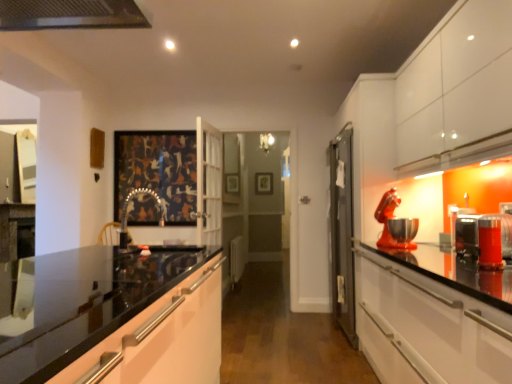
What do you see at coordinates (391, 218) in the screenshot?
I see `metallic red stand mixer at right, which is the fourth appliance in front-to-back order` at bounding box center [391, 218].

Identify the location of metallic silver toaster at right, the second appliance from the front. (506, 229).

You are a GUI agent. You are given a task and a screenshot of the screen. Output one action in this format:
    pyautogui.click(x=<x>, y=<y>)
    Task: Click on the metallic faucet at center
    This screenshot has height=384, width=512.
    Given the screenshot: What is the action you would take?
    pyautogui.click(x=128, y=214)

Describe the element at coordinates (162, 338) in the screenshot. I see `glossy black countertop at center` at that location.

Where is `wooden picture frame at center, the 1th picture frame in the back-to-front sequence`? The image size is (512, 384). wooden picture frame at center, the 1th picture frame in the back-to-front sequence is located at coordinates (264, 183).

The width and height of the screenshot is (512, 384). What do you see at coordinates (478, 234) in the screenshot? I see `metallic silver toaster at right, the 3th appliance in the front-to-back sequence` at bounding box center [478, 234].

In order to click on metallic red stand mixer at right, which is the fourth appliance in front-to-back order in this screenshot , I will do `click(391, 218)`.

From a real-world perspective, does metallic silver toaster at right, the 3th appliance in the front-to-back sequence, sit lower than metallic faucet at center?

Yes, from a real-world perspective, metallic silver toaster at right, the 3th appliance in the front-to-back sequence, is beneath metallic faucet at center.

Consider the image. Is metallic silver toaster at right, which is counted as the 2th appliance, starting from the back, situated inside metallic faucet at center or outside?

metallic silver toaster at right, which is counted as the 2th appliance, starting from the back, exists outside the volume of metallic faucet at center.

Between metallic silver toaster at right, the 3th appliance in the front-to-back sequence, and metallic faucet at center, which one has less height?

metallic silver toaster at right, the 3th appliance in the front-to-back sequence, is shorter.

Considering the positions of objects metallic faucet at center and metallic silver toaster at right, the 3th appliance in the front-to-back sequence, in the image provided, who is more to the left, metallic faucet at center or metallic silver toaster at right, the 3th appliance in the front-to-back sequence,?

Positioned to the left is metallic faucet at center.

Locate an element on the screen. This screenshot has width=512, height=384. faucet behind the metallic silver toaster at right, the 3th appliance in the front-to-back sequence is located at coordinates (128, 214).

From the image's perspective, is metallic faucet at center above or below metallic silver toaster at right, which is counted as the 2th appliance, starting from the back?

metallic faucet at center is above metallic silver toaster at right, which is counted as the 2th appliance, starting from the back.

From a real-world perspective, which object stands above the other?

metallic faucet at center, from a real-world perspective.

From a real-world perspective, is metallic red stand mixer at right, which is the fourth appliance in front-to-back order, positioned above or below metallic faucet at center?

From a real-world perspective, metallic red stand mixer at right, which is the fourth appliance in front-to-back order, is physically above metallic faucet at center.

Considering the sizes of objects metallic red stand mixer at right, the 1th appliance from the back, and metallic faucet at center in the image provided, who is bigger, metallic red stand mixer at right, the 1th appliance from the back, or metallic faucet at center?

metallic red stand mixer at right, the 1th appliance from the back, is bigger.

Which object is further away from the camera, metallic red stand mixer at right, which is the fourth appliance in front-to-back order, or metallic faucet at center?

metallic red stand mixer at right, which is the fourth appliance in front-to-back order, is more distant.

Considering the relative positions of glossy black countertop at center and metallic silver toaster at right, which is counted as the 2th appliance, starting from the back, in the image provided, is glossy black countertop at center behind metallic silver toaster at right, which is counted as the 2th appliance, starting from the back,?

No.

Looking at this image, is glossy black countertop at center not within metallic silver toaster at right, which is counted as the 2th appliance, starting from the back?

Yes, glossy black countertop at center is located beyond the bounds of metallic silver toaster at right, which is counted as the 2th appliance, starting from the back.

Is glossy black countertop at center bigger or smaller than metallic silver toaster at right, which is counted as the 2th appliance, starting from the back?

In the image, glossy black countertop at center appears to be larger than metallic silver toaster at right, which is counted as the 2th appliance, starting from the back.

Is point (212, 300) more distant than point (505, 231)?

That is True.

Which object is closer to the camera taking this photo, metallic faucet at center or glossy black countertop at center?

Positioned in front is glossy black countertop at center.

Is metallic faucet at center oriented away from glossy black countertop at center?

No, metallic faucet at center is not facing away from glossy black countertop at center.

In the scene shown: Is metallic faucet at center beside glossy black countertop at center?

metallic faucet at center and glossy black countertop at center are not in contact.

In the scene shown: Looking at the image, does metallic faucet at center seem bigger or smaller compared to glossy black countertop at center?

Clearly, metallic faucet at center is smaller in size than glossy black countertop at center.

Is dark fabric picture frame at center, acting as the 1th picture frame starting from the front, taller than metallic red stand mixer at right, which is the fourth appliance in front-to-back order?

Yes.

Is dark fabric picture frame at center, arranged as the second picture frame when viewed from the right, looking in the opposite direction of metallic red stand mixer at right, which is the fourth appliance in front-to-back order?

dark fabric picture frame at center, arranged as the second picture frame when viewed from the right, is not turned away from metallic red stand mixer at right, which is the fourth appliance in front-to-back order.

Measure the distance from dark fabric picture frame at center, the first picture frame from the left, to metallic red stand mixer at right, the 1th appliance from the back.

They are 8.86 feet apart.

Based on the photo, is dark fabric picture frame at center, the first picture frame from the left, smaller than metallic red stand mixer at right, which is the fourth appliance in front-to-back order?

Actually, dark fabric picture frame at center, the first picture frame from the left, might be larger than metallic red stand mixer at right, which is the fourth appliance in front-to-back order.

Is wooden picture frame at center, the 1th picture frame positioned from the right, located outside glossy black countertop at center?

Absolutely, wooden picture frame at center, the 1th picture frame positioned from the right, is external to glossy black countertop at center.

From the image's perspective, is wooden picture frame at center, the 1th picture frame positioned from the right, located above or below glossy black countertop at center?

wooden picture frame at center, the 1th picture frame positioned from the right, is above glossy black countertop at center.

From a real-world perspective, is wooden picture frame at center, the 2th picture frame in the front-to-back sequence, located higher than glossy black countertop at center?

Correct, in the physical world, wooden picture frame at center, the 2th picture frame in the front-to-back sequence, is higher than glossy black countertop at center.

Where is `the 2nd appliance below the metallic faucet at center (from a real-world perspective)`? This screenshot has width=512, height=384. the 2nd appliance below the metallic faucet at center (from a real-world perspective) is located at coordinates (478, 234).

At what (x,y) coordinates should I click in order to perform the action: click on the 3rd appliance to the right of the metallic faucet at center, starting your count from the anchor. Please return your answer as a coordinate pair (x, y). Image resolution: width=512 pixels, height=384 pixels. Looking at the image, I should click on (478, 234).

From the image, which object appears to be nearer to metallic faucet at center, metallic silver toaster at right, the 3th appliance in the front-to-back sequence, or metallic silver toaster at right, the second appliance from the front?

metallic silver toaster at right, the 3th appliance in the front-to-back sequence.

When comparing their distances from metallic silver toaster at right, the third appliance positioned from the back, does glossy black countertop at center or metallic faucet at center seem closer?

glossy black countertop at center lies closer to metallic silver toaster at right, the third appliance positioned from the back, than the other object.

Looking at the image, which one is located further to metallic red stand mixer at right, which is the fourth appliance in front-to-back order, metallic silver toaster at right, the 3th appliance in the front-to-back sequence, or dark fabric picture frame at center, acting as the 1th picture frame starting from the front?

Based on the image, dark fabric picture frame at center, acting as the 1th picture frame starting from the front, appears to be further to metallic red stand mixer at right, which is the fourth appliance in front-to-back order.

Considering their positions, is metallic silver toaster at right, the second appliance from the front, positioned closer to metallic silver toaster at right, which is counted as the 2th appliance, starting from the back, than glossy black countertop at center?

metallic silver toaster at right, the second appliance from the front, is closer to metallic silver toaster at right, which is counted as the 2th appliance, starting from the back.

From the image, which object appears to be nearer to translucent orange glass at right, which is counted as the 1th appliance, starting from the front, wooden picture frame at center, the 2th picture frame in the front-to-back sequence, or metallic faucet at center?

The object closer to translucent orange glass at right, which is counted as the 1th appliance, starting from the front, is metallic faucet at center.

From the image, which object appears to be farther from dark fabric picture frame at center, the first picture frame from the left, metallic silver toaster at right, the third appliance positioned from the back, or metallic red stand mixer at right, which is the fourth appliance in front-to-back order?

metallic silver toaster at right, the third appliance positioned from the back, is further to dark fabric picture frame at center, the first picture frame from the left.

When comparing their distances from metallic silver toaster at right, the second appliance from the front, does glossy black countertop at center or metallic red stand mixer at right, which is the fourth appliance in front-to-back order, seem closer?

metallic red stand mixer at right, which is the fourth appliance in front-to-back order.

Which object lies further to the anchor point translucent orange glass at right, positioned as the 4th appliance in back-to-front order, wooden picture frame at center, the 1th picture frame in the back-to-front sequence, or metallic red stand mixer at right, the 1th appliance from the back?

Based on the image, wooden picture frame at center, the 1th picture frame in the back-to-front sequence, appears to be further to translucent orange glass at right, positioned as the 4th appliance in back-to-front order.

I want to click on faucet between glossy black countertop at center and metallic silver toaster at right, the 3th appliance in the front-to-back sequence, in the horizontal direction, so click(x=128, y=214).

The image size is (512, 384). Identify the location of picture frame positioned between translucent orange glass at right, positioned as the 4th appliance in back-to-front order, and wooden picture frame at center, the 1th picture frame positioned from the right, from near to far. (157, 170).

This screenshot has height=384, width=512. I want to click on appliance between metallic silver toaster at right, the 3th appliance in the front-to-back sequence, and wooden picture frame at center, the 1th picture frame in the back-to-front sequence, in the front-back direction, so click(x=391, y=218).

Locate an element on the screen. appliance between metallic silver toaster at right, which is counted as the 2th appliance, starting from the back, and dark fabric picture frame at center, arranged as the second picture frame when viewed from the right, along the z-axis is located at coordinates (391, 218).